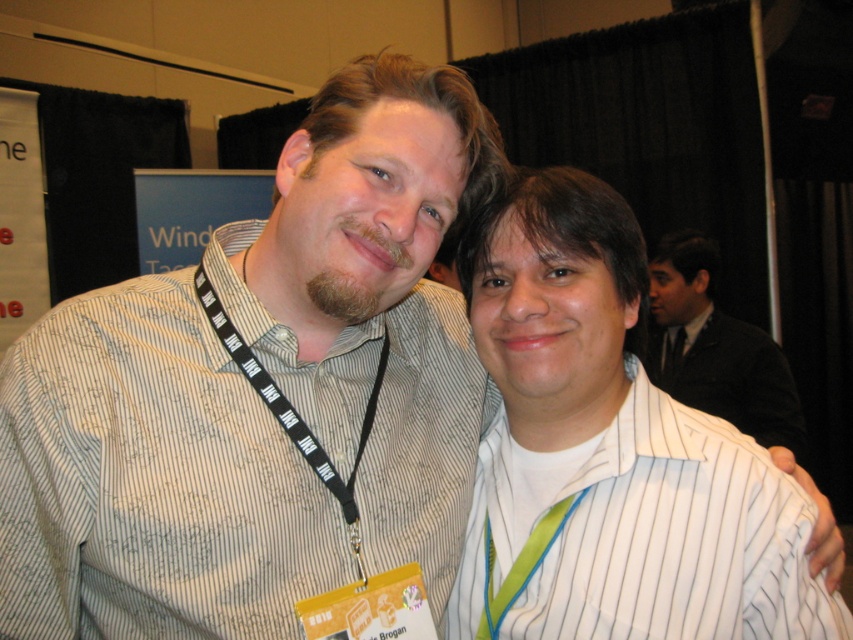
Is striped cotton shirt at center smaller than black suit jacket at upper right?

Indeed, striped cotton shirt at center has a smaller size compared to black suit jacket at upper right.

Is striped cotton shirt at center shorter than black suit jacket at upper right?

Indeed, striped cotton shirt at center has a lesser height compared to black suit jacket at upper right.

Is point (138, 328) closer to viewer compared to point (730, 365)?

Yes.

This screenshot has width=853, height=640. What are the coordinates of `striped cotton shirt at center` in the screenshot? It's located at (151, 480).

Is point (430, 484) positioned after point (196, 285)?

That is True.

What do you see at coordinates (151, 480) in the screenshot?
I see `striped cotton shirt at center` at bounding box center [151, 480].

Where is `striped cotton shirt at center`? striped cotton shirt at center is located at coordinates (151, 480).

Does white striped shirt at center have a smaller size compared to black fabric lanyard at left?

No, white striped shirt at center is not smaller than black fabric lanyard at left.

Can you confirm if white striped shirt at center is positioned to the right of black fabric lanyard at left?

Yes, white striped shirt at center is to the right of black fabric lanyard at left.

Locate an element on the screen. This screenshot has height=640, width=853. white striped shirt at center is located at coordinates (677, 538).